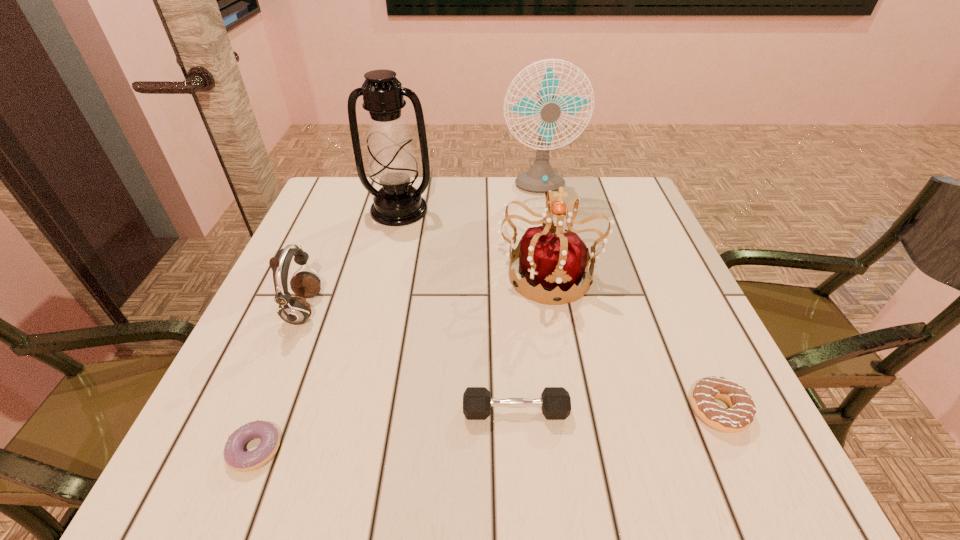
Locate an element on the screen. The height and width of the screenshot is (540, 960). doughnut situated at the left edge is located at coordinates [237, 459].

The height and width of the screenshot is (540, 960). I want to click on object at the right edge, so click(740, 416).

Locate an element on the screen. The height and width of the screenshot is (540, 960). object located at the far left corner is located at coordinates (392, 163).

Find the location of a particular element. object present at the near left corner is located at coordinates (237, 459).

At what (x,y) coordinates should I click in order to perform the action: click on object located in the near right corner section of the desktop. Please return your answer as a coordinate pair (x, y). This screenshot has width=960, height=540. Looking at the image, I should click on (740, 416).

Locate an element on the screen. free space at the far edge is located at coordinates (445, 211).

The width and height of the screenshot is (960, 540). Find the location of `vacant region at the near edge of the desktop`. vacant region at the near edge of the desktop is located at coordinates (554, 472).

The image size is (960, 540). In the image, there is a desktop. In order to click on vacant area at the left edge in this screenshot , I will do `click(337, 314)`.

Identify the location of vacant space at the right edge. (661, 338).

In the image, there is a desktop. At what (x,y) coordinates should I click in order to perform the action: click on blank space at the far left corner. Please return your answer as a coordinate pair (x, y). The height and width of the screenshot is (540, 960). Looking at the image, I should click on (320, 203).